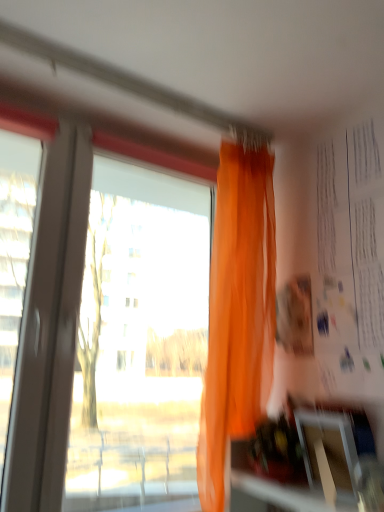
Question: From a real-world perspective, is transparent plastic window screen at lower right above or below white paper at upper right?

Choices:
 (A) below
 (B) above

Answer: (A)

Question: Is transparent plastic window screen at lower right taller or shorter than white paper at upper right?

Choices:
 (A) short
 (B) tall

Answer: (A)

Question: Which object is positioned farthest from the white paper at upper right?

Choices:
 (A) orange sheer curtain at upper center
 (B) transparent glass window at upper left
 (C) transparent plastic window screen at lower right

Answer: (B)

Question: Considering the real-world distances, which object is farthest from the transparent plastic window screen at lower right?

Choices:
 (A) white paper at upper right
 (B) orange sheer curtain at upper center
 (C) transparent glass window at upper left

Answer: (C)